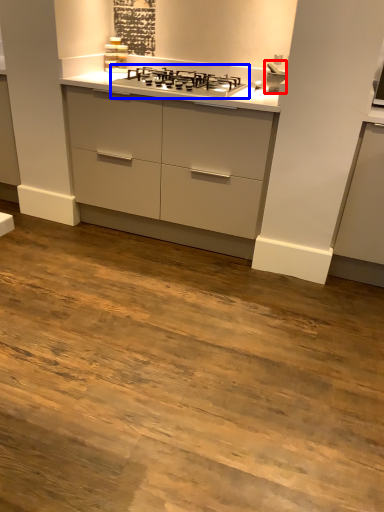
Question: Which object appears farthest to the camera in this image, sink (highlighted by a red box) or gas stove (highlighted by a blue box)?

Choices:
 (A) sink
 (B) gas stove

Answer: (A)